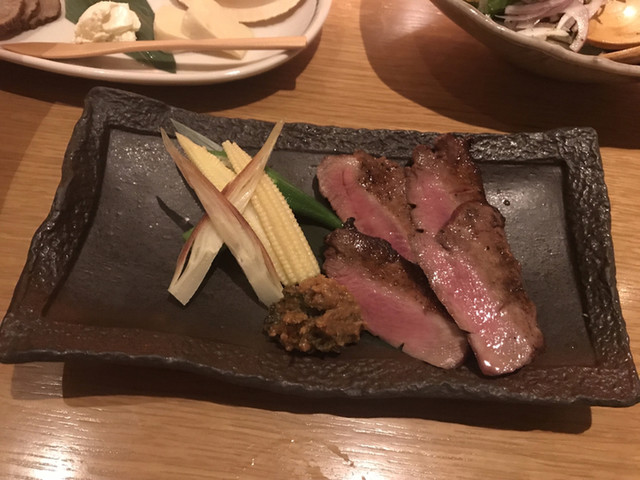
At what (x,y) coordinates should I click in order to perform the action: click on bowl. Please return your answer as a coordinate pair (x, y). This screenshot has width=640, height=480. Looking at the image, I should click on (534, 53).